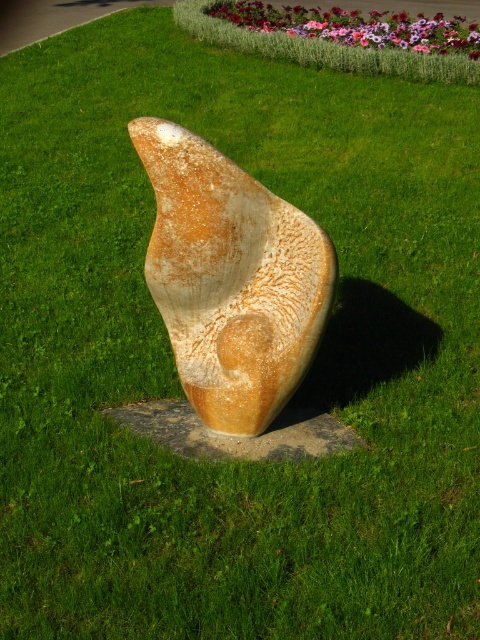
Question: Which point is farther to the camera?

Choices:
 (A) rustic stone sculpture at center
 (B) rusty stone sculpture at center

Answer: (B)

Question: Which is farther from the pastel floral bed at upper center?

Choices:
 (A) rustic stone sculpture at center
 (B) rusty stone sculpture at center

Answer: (B)

Question: Can you confirm if rustic stone sculpture at center is positioned to the right of rusty stone sculpture at center?

Choices:
 (A) yes
 (B) no

Answer: (A)

Question: Is rustic stone sculpture at center closer to the viewer compared to rusty stone sculpture at center?

Choices:
 (A) no
 (B) yes

Answer: (B)

Question: Which object is farther from the camera taking this photo?

Choices:
 (A) rustic stone sculpture at center
 (B) pastel floral bed at upper center
 (C) rusty stone sculpture at center

Answer: (B)

Question: Can you confirm if rustic stone sculpture at center is smaller than pastel floral bed at upper center?

Choices:
 (A) no
 (B) yes

Answer: (B)